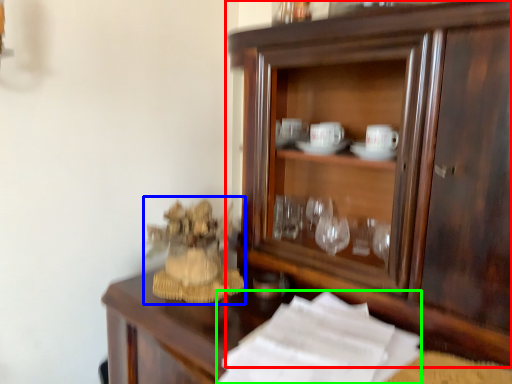
Question: Estimate the real-world distances between objects in this image. Which object is farther from cupboard (highlighted by a red box), toy (highlighted by a blue box) or paper (highlighted by a green box)?

Choices:
 (A) toy
 (B) paper

Answer: (A)